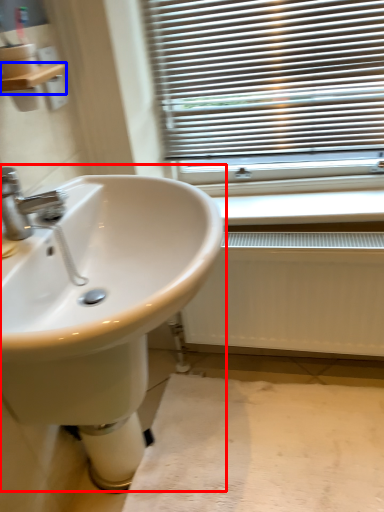
Question: Which object appears closest to the camera in this image, sink (highlighted by a red box) or balustrade (highlighted by a blue box)?

Choices:
 (A) sink
 (B) balustrade

Answer: (A)